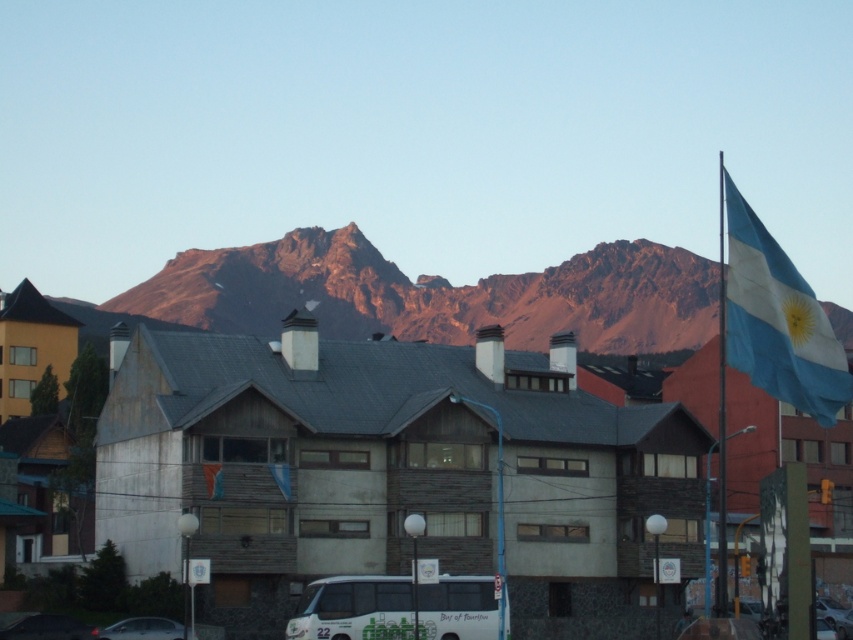
You are standing in front of the building and want to locate two points marked in the image. Which of the two points, point (790, 362) or point (28, 637), is closer to you?

Point (790, 362) is closer to the viewer than point (28, 637).

You are standing in front of the rustic building and want to park your car. The white matte bus at lower center is blocking the entrance. Can you drive around the matte black car at lower left to reach the entrance?

The white matte bus at lower center is to the right of the matte black car at lower left, so you can drive around the matte black car at lower left to the left side to reach the entrance.

You are a photographer planning to capture the wooden cabin at center and the white matte bus at lower center in a single frame. Considering their heights, which object will appear taller in your photo?

The wooden cabin at center will appear taller in the photo since it has a greater height compared to the white matte bus at lower center.